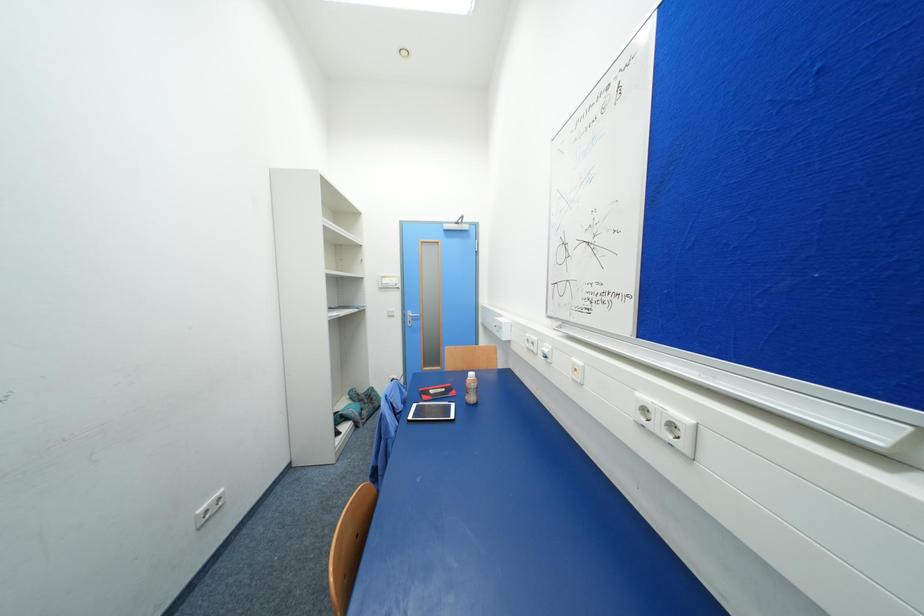
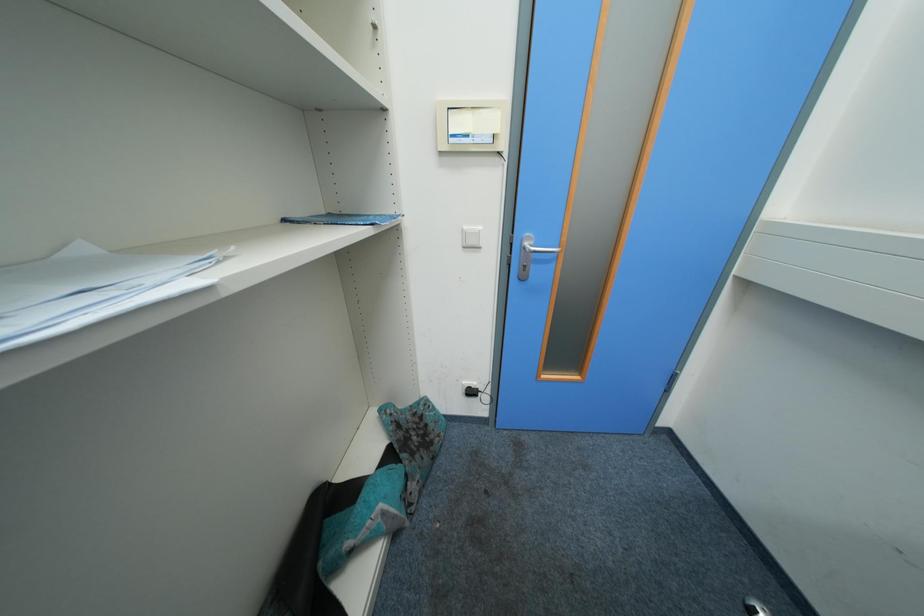
Which direction would the cameraman need to move to produce the second image?

The movement direction of the cameraman is left, forward.